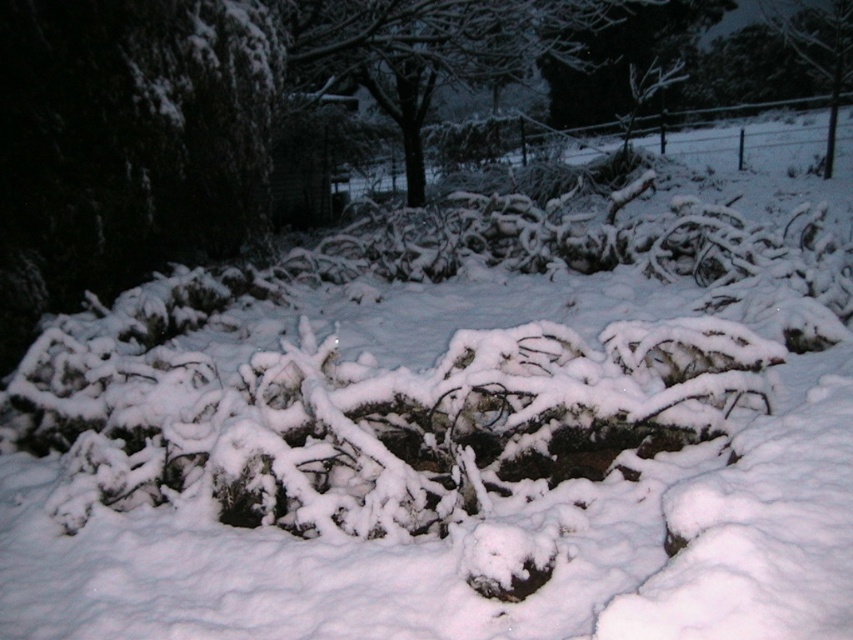
Question: Can you confirm if snow-covered tree at center is wider than smooth bark tree at upper right?

Choices:
 (A) yes
 (B) no

Answer: (B)

Question: Which object is positioned closest to the snow-covered tree at center?

Choices:
 (A) smooth bark tree at upper right
 (B) snow-covered branches at upper center

Answer: (B)

Question: Which point appears farthest from the camera in this image?

Choices:
 (A) (828, 33)
 (B) (549, 49)

Answer: (A)

Question: Which of these objects is positioned closest to the snow-covered tree at center?

Choices:
 (A) smooth bark tree at upper right
 (B) snow-covered branches at upper center

Answer: (B)

Question: Can you confirm if snow-covered branches at upper center is positioned to the left of smooth bark tree at upper right?

Choices:
 (A) yes
 (B) no

Answer: (A)

Question: Can you confirm if snow-covered tree at center is positioned to the right of snow-covered branches at upper center?

Choices:
 (A) yes
 (B) no

Answer: (B)